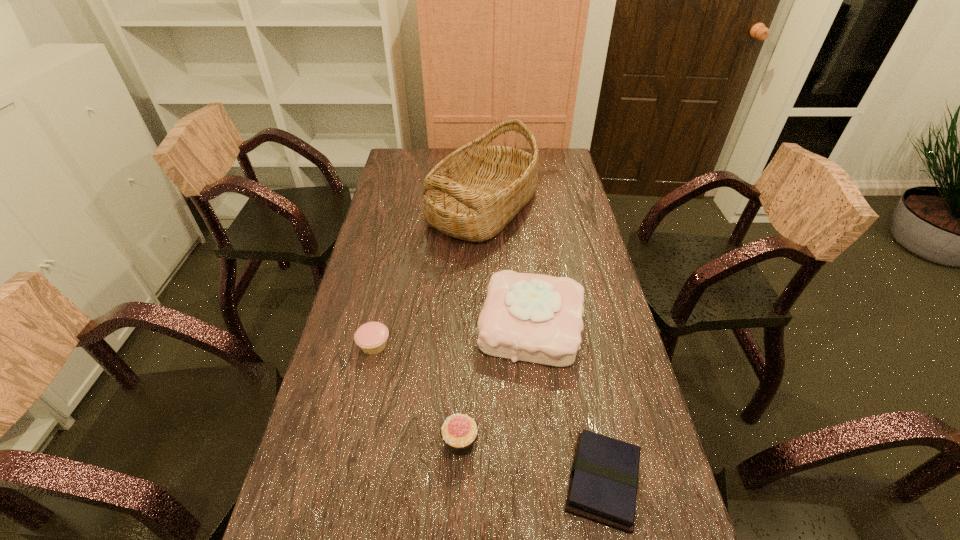
At what (x,y) coordinates should I click in order to perform the action: click on vacant area at the far right corner of the desktop. Please return your answer as a coordinate pair (x, y). The image size is (960, 540). Looking at the image, I should click on (552, 159).

Where is `blank region between the basket and the cake`? blank region between the basket and the cake is located at coordinates (507, 267).

Identify the location of free space between the third tallest object and the cake. The image size is (960, 540). (495, 384).

At what (x,y) coordinates should I click in order to perform the action: click on vacant region between the cake and the taller cupcake. Please return your answer as a coordinate pair (x, y). The image size is (960, 540). Looking at the image, I should click on (495, 384).

The height and width of the screenshot is (540, 960). What are the coordinates of `blank region between the tallest object and the cake` in the screenshot? It's located at (507, 267).

Locate an element on the screen. blank region between the cake and the basket is located at coordinates (507, 267).

Locate an element on the screen. The height and width of the screenshot is (540, 960). vacant area that lies between the fourth tallest object and the book is located at coordinates (489, 414).

This screenshot has width=960, height=540. In order to click on free space between the farther cupcake and the tallest object in this screenshot , I will do `click(428, 276)`.

Where is `vacant space that is in between the book and the leftmost object`? vacant space that is in between the book and the leftmost object is located at coordinates (489, 414).

Locate an element on the screen. vacant area that lies between the right cupcake and the shortest object is located at coordinates (532, 462).